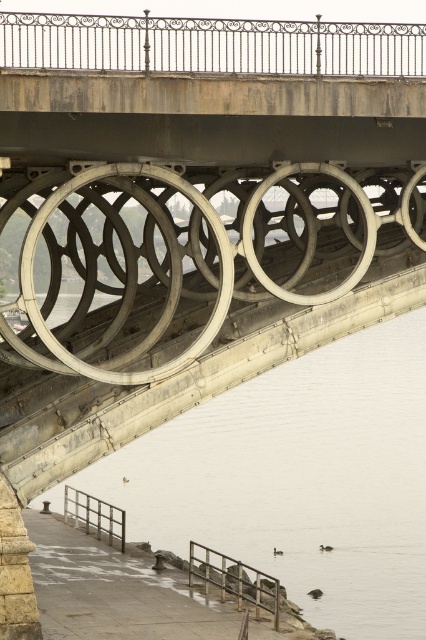
You are standing on the bridge and looking down at the water. There is a point marked at coordinates (x=301, y=480). What is located at this point?

The point at coordinates (x=301, y=480) corresponds to white smooth water at lower center.

You are standing on the bridge and want to see the white smooth water at lower center. Which direction should you look relative to the metallic gray railing at lower left?

The white smooth water at lower center is positioned over the metallic gray railing at lower left, so you should look upward from the metallic gray railing at lower left to see the white smooth water at lower center.